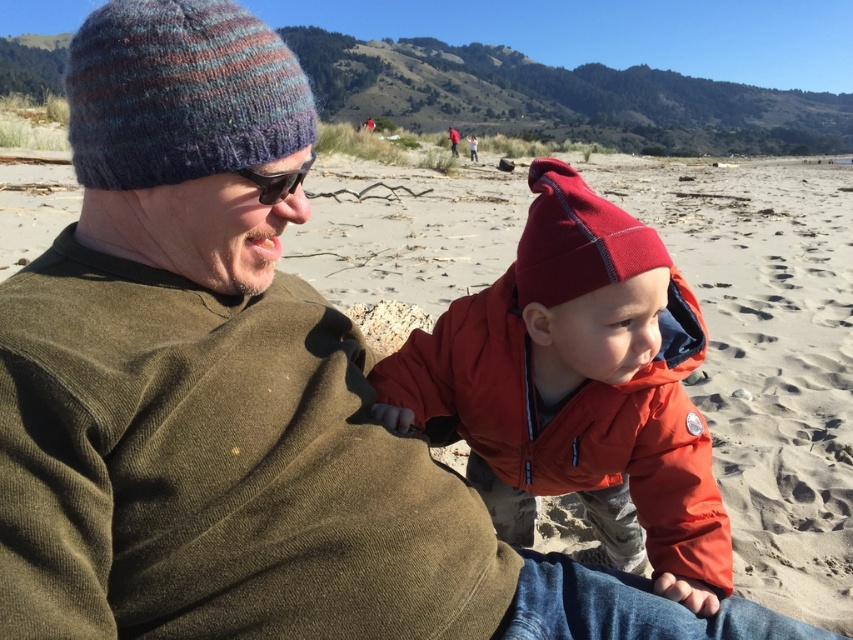
Which is in front, point (509, 339) or point (219, 17)?

Point (219, 17)

Is matte orange jacket at center shorter than multicolored knitted beanie at upper left?

In fact, matte orange jacket at center may be taller than multicolored knitted beanie at upper left.

Find the location of a particular element. This screenshot has width=853, height=640. matte orange jacket at center is located at coordinates (578, 388).

Is multicolored knitted beanie at upper left further to camera compared to matte red knit beanie at center?

That is False.

You are a GUI agent. You are given a task and a screenshot of the screen. Output one action in this format:
    pyautogui.click(x=<x>, y=<y>)
    Task: Click on the multicolored knitted beanie at upper left
    Image resolution: width=853 pixels, height=640 pixels.
    Given the screenshot: What is the action you would take?
    pyautogui.click(x=180, y=93)

Based on the photo, can you confirm if matte orange jacket at center is taller than matte red knit beanie at center?

Indeed, matte orange jacket at center has a greater height compared to matte red knit beanie at center.

Is point (543, 252) closer to viewer compared to point (581, 236)?

No, (543, 252) is behind (581, 236).

Locate an element on the screen. The height and width of the screenshot is (640, 853). matte orange jacket at center is located at coordinates (578, 388).